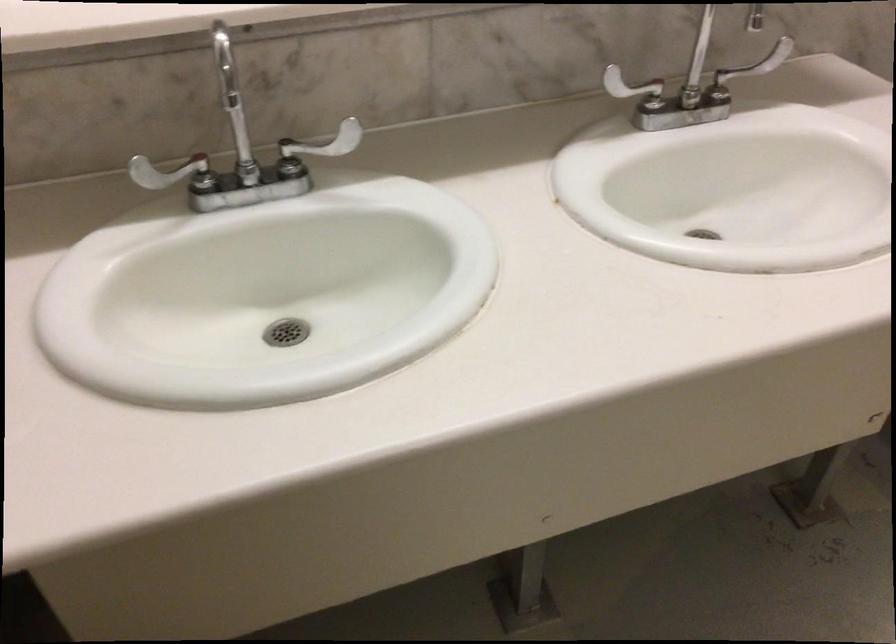
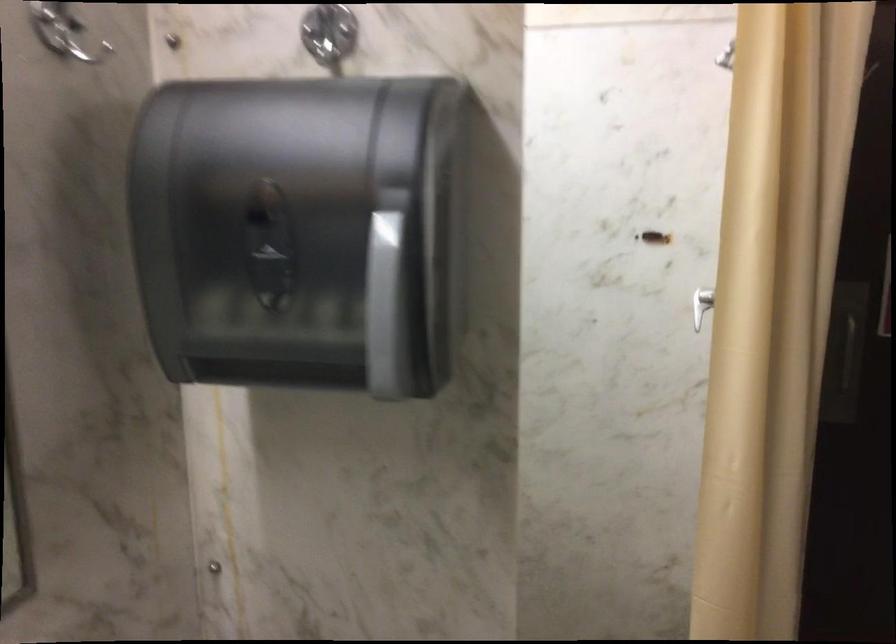
Question: The first image is from the beginning of the video and the second image is from the end. How did the camera likely rotate when shooting the video?

Choices:
 (A) Left
 (B) Right
 (C) Up
 (D) Down

Answer: (B)